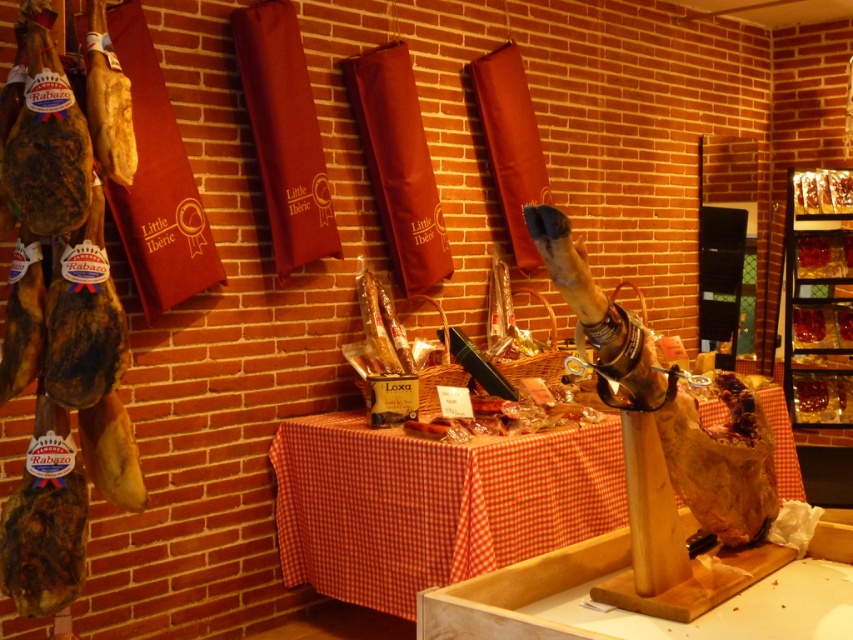
Question: Estimate the real-world distances between objects in this image. Which object is closer to the red checkered fabric table at center?

Choices:
 (A) translucent glass shelves at upper right
 (B) golden-brown crispy pastry at center
 (C) brown leather ham at left

Answer: (C)

Question: Which point is farther from the camera taking this photo?

Choices:
 (A) (131, 461)
 (B) (837, 179)

Answer: (B)

Question: Can you confirm if golden-brown crispy pastry at center is bigger than shiny red jam at center?

Choices:
 (A) no
 (B) yes

Answer: (B)

Question: Is brown leather ham at left below shiny red jam at center?

Choices:
 (A) yes
 (B) no

Answer: (B)

Question: Does red checkered fabric table at center have a smaller size compared to shiny red jam at center?

Choices:
 (A) no
 (B) yes

Answer: (A)

Question: Which object is closer to the camera taking this photo?

Choices:
 (A) red checkered fabric table at center
 (B) shiny red meat at center
 (C) brown leather ham at left
 (D) shiny red jam at center

Answer: (C)